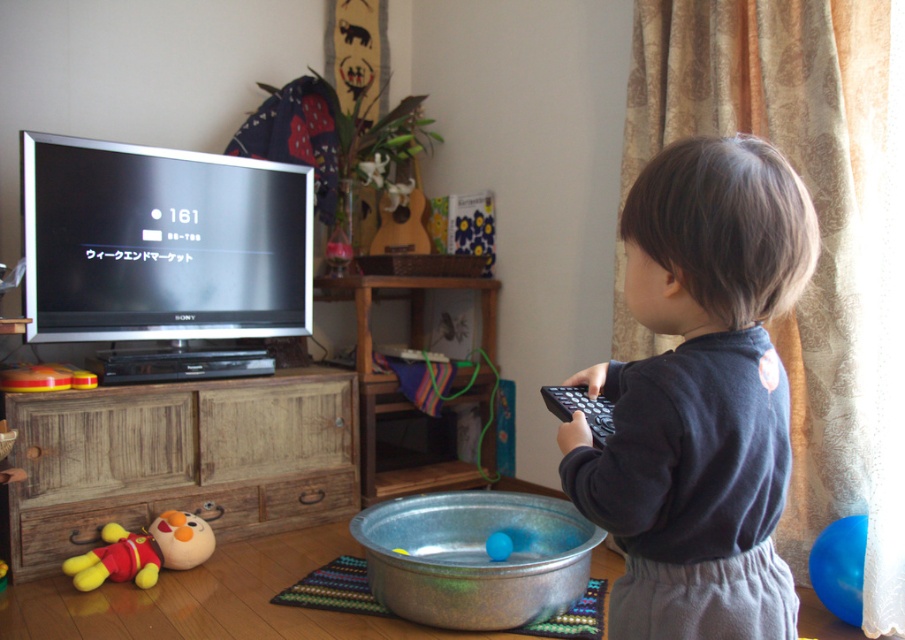
You are a parent trying to tidy up the living room. You need to place both the dark blue fleece at center and the yellow plush toy at lower left into a storage box. The box can only fit one of them. Which object should you choose to ensure it fits inside the box?

The yellow plush toy at lower left should be placed in the box because the dark blue fleece at center is bigger and won

You are a parent who wants to hand the black matte remote at right to your child who is standing near the metallic blue bowl at lower center. Can you place the remote directly in front of the child without moving the bowl?

The black matte remote at right is already in front of the metallic blue bowl at lower center, so placing it directly in front of the child would require moving the bowl since the remote is currently positioned in front of it.